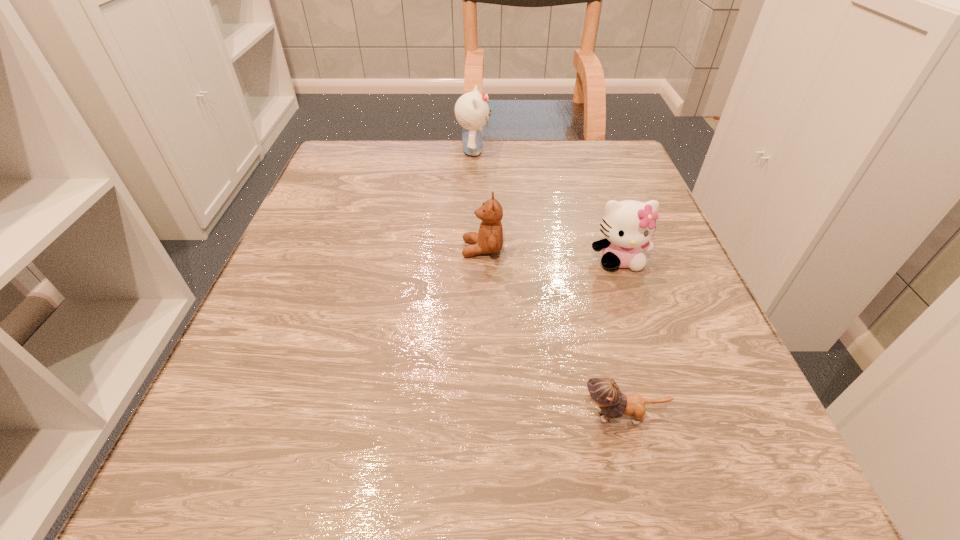
You are a GUI agent. You are given a task and a screenshot of the screen. Output one action in this format:
    pyautogui.click(x=<x>, y=<y>)
    Task: Click on the tallest object
    
    Given the screenshot: What is the action you would take?
    pyautogui.click(x=472, y=112)

Locate an element on the screen. the tallest kitten is located at coordinates (472, 112).

You are a GUI agent. You are given a task and a screenshot of the screen. Output one action in this format:
    pyautogui.click(x=<x>, y=<y>)
    Task: Click on the second shortest kitten
    Image resolution: width=960 pixels, height=540 pixels.
    Given the screenshot: What is the action you would take?
    pyautogui.click(x=628, y=225)

The width and height of the screenshot is (960, 540). I want to click on teddy bear, so click(x=489, y=240).

Find the location of `the shortest object`. the shortest object is located at coordinates (605, 393).

The height and width of the screenshot is (540, 960). I want to click on the shortest kitten, so click(x=605, y=393).

Image resolution: width=960 pixels, height=540 pixels. Find the location of `vacant region located on the front-facing side of the farthest kitten`. vacant region located on the front-facing side of the farthest kitten is located at coordinates (524, 151).

The height and width of the screenshot is (540, 960). Find the location of `free region located on the front-facing side of the second nearest kitten`. free region located on the front-facing side of the second nearest kitten is located at coordinates (647, 342).

This screenshot has height=540, width=960. I want to click on vacant space located 0.160m on the face of the teddy bear, so click(373, 249).

The image size is (960, 540). Find the location of `vacant region located 0.280m on the face of the teddy bear`. vacant region located 0.280m on the face of the teddy bear is located at coordinates (306, 249).